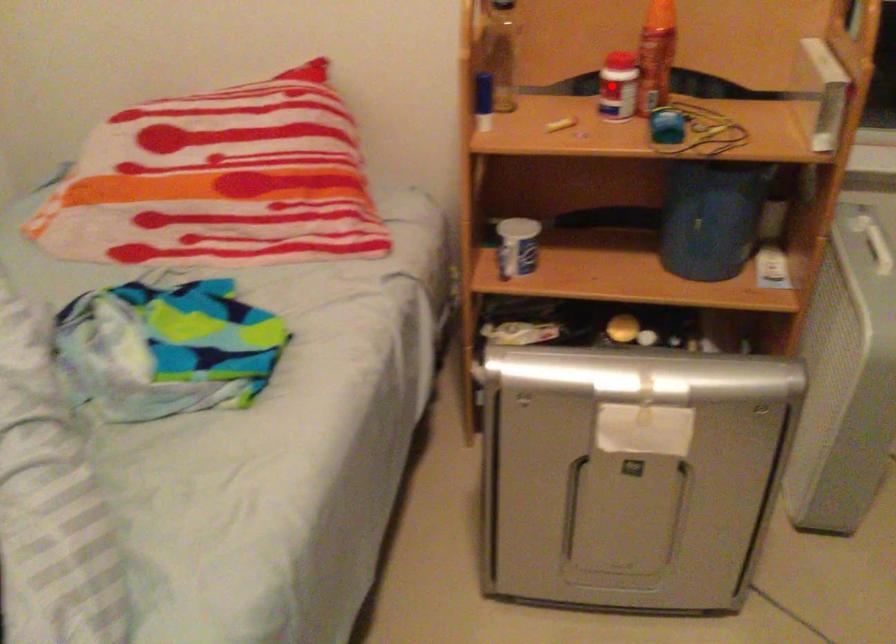
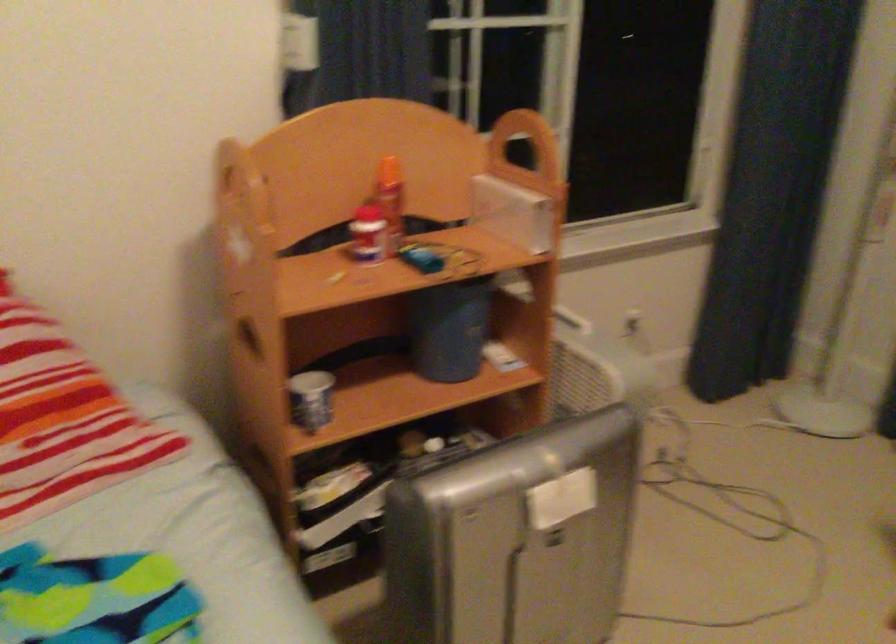
Find the pixel in the second image that matches the highlighted location in the first image.

(367, 234)